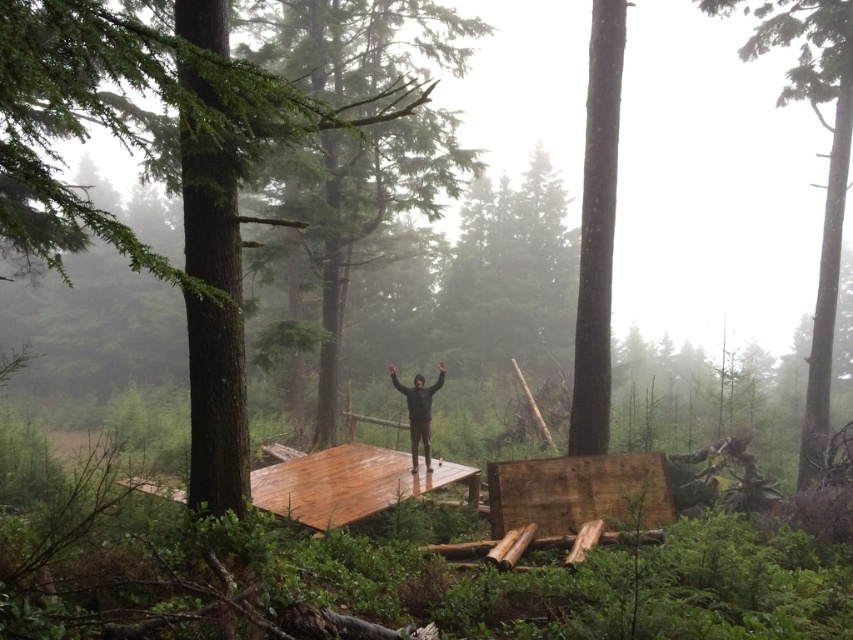
You are planning to place a small decorative item on the smooth brown wooden platform at center. Considering the size of the platform and the black matte jacket at center, will there be enough space for the item?

The smooth brown wooden platform at center has a larger size compared to the black matte jacket at center, so there should be sufficient space to place the small decorative item on the platform.